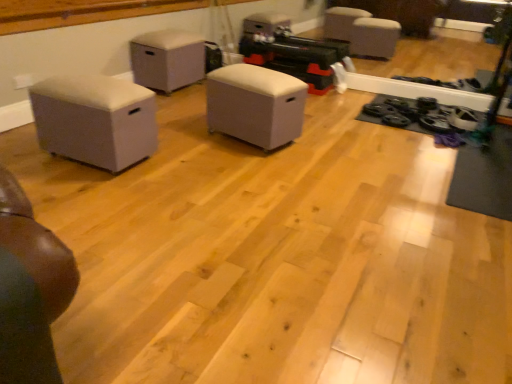
Question: Which direction should I rotate to look at white fabric ottoman at center, which is the 2th furniture in back-to-front order?

Choices:
 (A) right
 (B) left

Answer: (B)

Question: Is white fabric ottoman at center, which is the 2th furniture in back-to-front order, wider than beige fabric ottoman at left, which appears as the first furniture when viewed from the front?

Choices:
 (A) yes
 (B) no

Answer: (B)

Question: From a real-world perspective, is white fabric ottoman at center, placed as the 2th furniture when sorted from front to back, positioned over beige fabric ottoman at left, which appears as the first furniture when viewed from the front, based on gravity?

Choices:
 (A) yes
 (B) no

Answer: (B)

Question: Can you confirm if white fabric ottoman at center, placed as the 2th furniture when sorted from front to back, is thinner than beige fabric ottoman at left, which appears as the first furniture when viewed from the front?

Choices:
 (A) yes
 (B) no

Answer: (A)

Question: Is white fabric ottoman at center, which is the 2th furniture in back-to-front order, positioned with its back to beige fabric ottoman at left, which appears as the first furniture when viewed from the front?

Choices:
 (A) no
 (B) yes

Answer: (A)

Question: Is white fabric ottoman at center, which is the 2th furniture in back-to-front order, to the right of beige fabric ottoman at left, which appears as the first furniture when viewed from the front, from the viewer's perspective?

Choices:
 (A) yes
 (B) no

Answer: (A)

Question: Can we say white fabric ottoman at center, which is the 2th furniture in back-to-front order, lies outside beige fabric ottoman at left, acting as the third furniture starting from the back?

Choices:
 (A) no
 (B) yes

Answer: (B)

Question: Does beige fabric ottoman at left, acting as the third furniture starting from the back, have a smaller size compared to matte gray ottoman at center, which is counted as the third furniture, starting from the front?

Choices:
 (A) no
 (B) yes

Answer: (B)

Question: From a real-world perspective, is beige fabric ottoman at left, which appears as the first furniture when viewed from the front, physically below matte gray ottoman at center, which is counted as the third furniture, starting from the front?

Choices:
 (A) no
 (B) yes

Answer: (B)

Question: Considering the relative sizes of beige fabric ottoman at left, which appears as the first furniture when viewed from the front, and matte gray ottoman at center, which is counted as the third furniture, starting from the front, in the image provided, is beige fabric ottoman at left, which appears as the first furniture when viewed from the front, taller than matte gray ottoman at center, which is counted as the third furniture, starting from the front,?

Choices:
 (A) no
 (B) yes

Answer: (A)

Question: Is beige fabric ottoman at left, which appears as the first furniture when viewed from the front, shorter than matte gray ottoman at center, which is counted as the third furniture, starting from the front?

Choices:
 (A) no
 (B) yes

Answer: (B)

Question: From the image's perspective, would you say beige fabric ottoman at left, which appears as the first furniture when viewed from the front, is positioned over matte gray ottoman at center, the first furniture when ordered from back to front?

Choices:
 (A) no
 (B) yes

Answer: (A)

Question: Is beige fabric ottoman at left, which appears as the first furniture when viewed from the front, touching matte gray ottoman at center, the first furniture when ordered from back to front?

Choices:
 (A) yes
 (B) no

Answer: (B)

Question: Can you confirm if beige fabric ottoman at left, acting as the third furniture starting from the back, is taller than white fabric ottoman at center, placed as the 2th furniture when sorted from front to back?

Choices:
 (A) yes
 (B) no

Answer: (B)